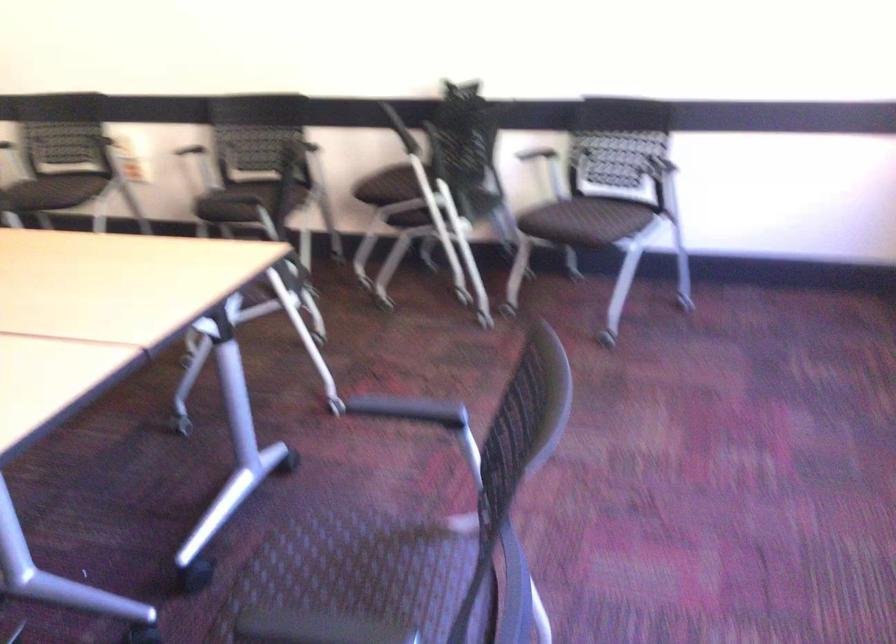
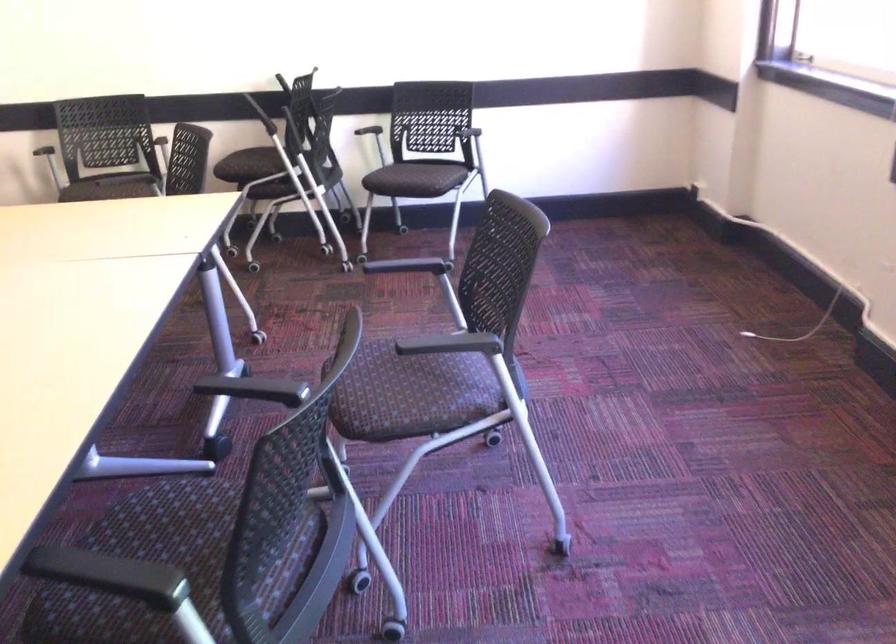
In the second image, find the point that corresponds to [337,550] in the first image.

(375, 366)